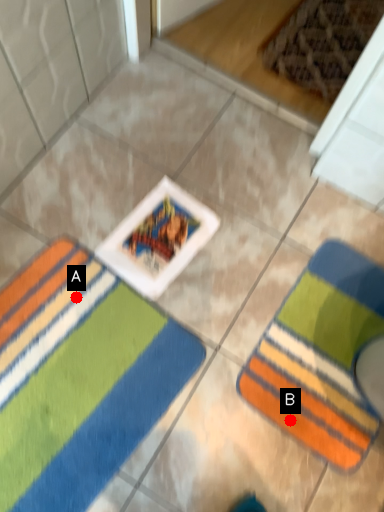
Question: Two points are circled on the image, labeled by A and B beside each circle. Which point is closer to the camera taking this photo?

Choices:
 (A) A is closer
 (B) B is closer

Answer: (B)